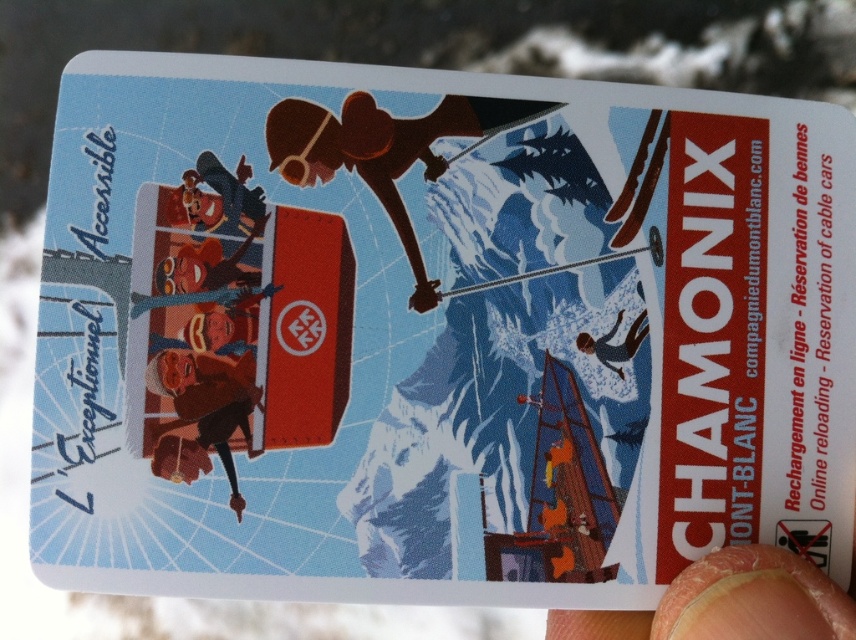
Can you confirm if matte brown skier at center is positioned to the left of blue matte skier at center?

Yes, matte brown skier at center is to the left of blue matte skier at center.

Is matte brown skier at center smaller than blue matte skier at center?

No, matte brown skier at center is not smaller than blue matte skier at center.

At what (x,y) coordinates should I click in order to perform the action: click on matte brown skier at center. Please return your answer as a coordinate pair (x, y). Looking at the image, I should click on (512, 380).

Does matte brown jacket at center-left have a greater width compared to matte brown snowboarder at center?

In fact, matte brown jacket at center-left might be narrower than matte brown snowboarder at center.

You are a GUI agent. You are given a task and a screenshot of the screen. Output one action in this format:
    pyautogui.click(x=<x>, y=<y>)
    Task: Click on the matte brown jacket at center-left
    
    Given the screenshot: What is the action you would take?
    pyautogui.click(x=205, y=323)

Between point (235, 179) and point (348, 134), which one is positioned in front?

Point (235, 179) is more forward.

Where is `matte brown jacket at center-left`? The image size is (856, 640). matte brown jacket at center-left is located at coordinates (205, 323).

Where is `matte brown skier at center`? matte brown skier at center is located at coordinates (512, 380).

Does matte brown skier at center have a larger size compared to matte brown snowboarder at center?

Yes, matte brown skier at center is bigger than matte brown snowboarder at center.

The image size is (856, 640). What do you see at coordinates (512, 380) in the screenshot? I see `matte brown skier at center` at bounding box center [512, 380].

You are a GUI agent. You are given a task and a screenshot of the screen. Output one action in this format:
    pyautogui.click(x=<x>, y=<y>)
    Task: Click on the matte brown skier at center
    This screenshot has width=856, height=640.
    Given the screenshot: What is the action you would take?
    pyautogui.click(x=512, y=380)